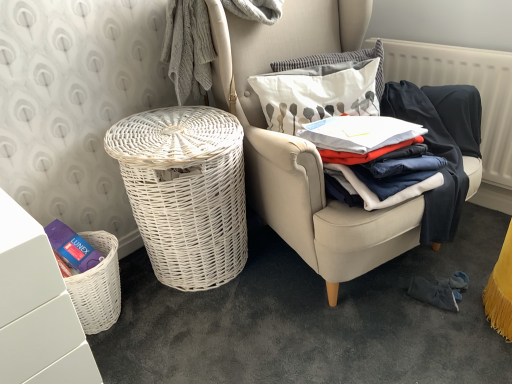
From the picture: In order to face white textured radiator at upper right, should I rotate leftwards or rightwards?

You should rotate right by 23.374 degrees.

Find the location of a particular element. white matte vanity at lower left is located at coordinates pyautogui.click(x=37, y=308).

Measure the distance between point (356,222) and camera.

Point (356,222) and camera are 1.21 meters apart from each other.

Find the location of `white textured radiator at upper right`. white textured radiator at upper right is located at coordinates click(464, 84).

From the image's perspective, would you say white fabric pillow at upper right, the second pillow in the top-to-bottom sequence, is positioned over white textured radiator at upper right?

Yes, from the image's perspective, white fabric pillow at upper right, the second pillow in the top-to-bottom sequence, is above white textured radiator at upper right.

From a real-world perspective, does white fabric pillow at upper right, the second pillow in the top-to-bottom sequence, sit lower than white textured radiator at upper right?

No, from a real-world perspective, white fabric pillow at upper right, the second pillow in the top-to-bottom sequence, is not below white textured radiator at upper right.

Considering the positions of objects white fabric pillow at upper right, the 1th pillow ordered from the bottom, and white textured radiator at upper right in the image provided, who is in front, white fabric pillow at upper right, the 1th pillow ordered from the bottom, or white textured radiator at upper right?

Positioned in front is white fabric pillow at upper right, the 1th pillow ordered from the bottom.

Are white fabric pillow at upper right, the second pillow in the top-to-bottom sequence, and white textured radiator at upper right making contact?

No, white fabric pillow at upper right, the second pillow in the top-to-bottom sequence, is not beside white textured radiator at upper right.

Is white textured radiator at upper right closer to camera compared to white wicker chair at center?

No, white textured radiator at upper right is behind white wicker chair at center.

Consider the image. From the image's perspective, is white textured radiator at upper right below white wicker chair at center?

Actually, white textured radiator at upper right appears above white wicker chair at center in the image.

How many degrees apart are the facing directions of white textured radiator at upper right and white wicker chair at center?

69.8 degrees.

Do you think white textured radiator at upper right is within white wicker chair at center, or outside of it?

white textured radiator at upper right cannot be found inside white wicker chair at center.

Find the location of a particular element. The width and height of the screenshot is (512, 384). vanity in front of the white wicker chair at center is located at coordinates (37, 308).

Is white matte vanity at lower left to the left or to the right of white wicker chair at center in the image?

In the image, white matte vanity at lower left appears on the left side of white wicker chair at center.

Which is closer to the camera, (36, 351) or (262, 205)?

Point (36, 351) appears to be closer to the viewer than point (262, 205).

From a real-world perspective, is white matte vanity at lower left positioned above or below white wicker chair at center?

From a real-world perspective, white matte vanity at lower left is physically below white wicker chair at center.

Image resolution: width=512 pixels, height=384 pixels. There is a dark blue cotton clothes at center right. Find the location of `the 2nd pillow above it (from a real-world perspective)`. the 2nd pillow above it (from a real-world perspective) is located at coordinates (337, 62).

Is dark blue cotton clothes at center right positioned behind white textured pillow at upper center, the 2th pillow ordered from the bottom?

No, dark blue cotton clothes at center right is in front of white textured pillow at upper center, the 2th pillow ordered from the bottom.

From the image's perspective, which one is positioned higher, dark blue cotton clothes at center right or white textured pillow at upper center, arranged as the first pillow when viewed from the top?

white textured pillow at upper center, arranged as the first pillow when viewed from the top.

Is point (349, 162) positioned in front of point (377, 72)?

Yes, it is in front of point (377, 72).

From the image's perspective, which is above, white wicker chair at center or white wicker basket at left?

white wicker chair at center, from the image's perspective.

Considering their positions, is white wicker chair at center located in front of or behind white wicker basket at left?

Visually, white wicker chair at center is located in front of white wicker basket at left.

At what (x,y) coordinates should I click in order to perform the action: click on basket on the left of white wicker chair at center. Please return your answer as a coordinate pair (x, y). Looking at the image, I should click on (185, 192).

In terms of size, does white wicker chair at center appear bigger or smaller than white wicker basket at left?

white wicker chair at center is bigger than white wicker basket at left.

Does white fabric pillow at upper right, the 1th pillow ordered from the bottom, have a smaller size compared to white wicker chair at center?

Yes, white fabric pillow at upper right, the 1th pillow ordered from the bottom, is smaller than white wicker chair at center.

Considering the positions of objects white fabric pillow at upper right, the second pillow in the top-to-bottom sequence, and white wicker chair at center in the image provided, who is behind, white fabric pillow at upper right, the second pillow in the top-to-bottom sequence, or white wicker chair at center?

white fabric pillow at upper right, the second pillow in the top-to-bottom sequence, is further from the camera.

Is point (316, 85) farther from camera compared to point (387, 222)?

Yes, it is.

Considering the relative sizes of white fabric pillow at upper right, the 1th pillow ordered from the bottom, and white wicker chair at center in the image provided, is white fabric pillow at upper right, the 1th pillow ordered from the bottom, thinner than white wicker chair at center?

Indeed, white fabric pillow at upper right, the 1th pillow ordered from the bottom, has a lesser width compared to white wicker chair at center.

Considering their positions, is white matte vanity at lower left located in front of or behind white wicker basket at left?

Clearly, white matte vanity at lower left is in front of white wicker basket at left.

Can you confirm if white matte vanity at lower left is taller than white wicker basket at left?

Yes.

From the image's perspective, is white matte vanity at lower left on top of white wicker basket at left?

No.

Is white wicker basket at left surrounded by white matte vanity at lower left?

No, white wicker basket at left is located outside of white matte vanity at lower left.

The width and height of the screenshot is (512, 384). Identify the location of radiator below the white fabric pillow at upper right, the 1th pillow ordered from the bottom (from the image's perspective). (464, 84).

This screenshot has height=384, width=512. Identify the location of chair located on the left of white textured radiator at upper right. (304, 143).

Based on their spatial positions, is white wicker basket at left or white matte vanity at lower left further from white textured pillow at upper center, arranged as the first pillow when viewed from the top?

white matte vanity at lower left is positioned further to the anchor white textured pillow at upper center, arranged as the first pillow when viewed from the top.

Looking at this image, looking at the image, which one is located further to white matte vanity at lower left, white wicker basket at left or dark blue cotton clothes at center right?

dark blue cotton clothes at center right.

Based on their spatial positions, is dark blue cotton clothes at center right or white fabric pillow at upper right, the 1th pillow ordered from the bottom, further from white wicker basket at left?

Answer: dark blue cotton clothes at center right.

From the image, which object appears to be farther from dark blue cotton clothes at center right, white wicker basket at left or white wicker chair at center?

white wicker basket at left.

Based on their spatial positions, is white fabric pillow at upper right, the second pillow in the top-to-bottom sequence, or white matte vanity at lower left closer to dark blue cotton clothes at center right?

Based on the image, white fabric pillow at upper right, the second pillow in the top-to-bottom sequence, appears to be nearer to dark blue cotton clothes at center right.

Looking at the image, which one is located closer to white wicker basket at left, white textured pillow at upper center, the 2th pillow ordered from the bottom, or dark blue cotton clothes at center right?

dark blue cotton clothes at center right lies closer to white wicker basket at left than the other object.

Based on their spatial positions, is dark blue cotton clothes at center right or white wicker basket at left further from white matte vanity at lower left?

The object further to white matte vanity at lower left is dark blue cotton clothes at center right.

In the scene shown: Which object lies nearer to the anchor point white textured pillow at upper center, the 2th pillow ordered from the bottom, white wicker chair at center or white wicker basket at left?

white wicker chair at center is positioned closer to the anchor white textured pillow at upper center, the 2th pillow ordered from the bottom.

Locate an element on the screen. This screenshot has height=384, width=512. clothing between white textured pillow at upper center, the 2th pillow ordered from the bottom, and white textured radiator at upper right is located at coordinates (360, 137).

Identify the location of clothing between white wicker chair at center and white textured radiator at upper right from front to back. (360, 137).

Find the location of a particular element. chair between white matte vanity at lower left and dark blue cotton clothes at center right from left to right is located at coordinates (304, 143).

Locate an element on the screen. clothing between white matte vanity at lower left and white textured radiator at upper right in the horizontal direction is located at coordinates (360, 137).